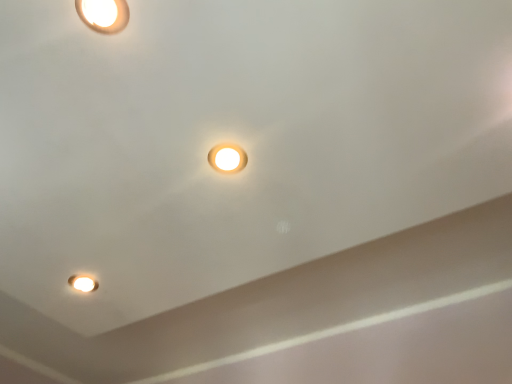
Question: From the image's perspective, would you say matte white light fixture at lower left is positioned over matte white lamp at upper left, acting as the 2th lamp starting from the right?

Choices:
 (A) no
 (B) yes

Answer: (A)

Question: From a real-world perspective, does matte white light fixture at lower left sit lower than matte white lamp at upper left, which is counted as the 2th lamp, starting from the back?

Choices:
 (A) no
 (B) yes

Answer: (A)

Question: Is matte white light fixture at lower left looking in the opposite direction of matte white lamp at upper left, acting as the 2th lamp starting from the right?

Choices:
 (A) no
 (B) yes

Answer: (A)

Question: Can you confirm if matte white light fixture at lower left is wider than matte white lamp at upper left, the first lamp in the left-to-right sequence?

Choices:
 (A) yes
 (B) no

Answer: (B)

Question: Can you confirm if matte white light fixture at lower left is smaller than matte white lamp at upper left, the first lamp from the top?

Choices:
 (A) yes
 (B) no

Answer: (A)

Question: Considering the relative sizes of matte white light fixture at lower left and matte white lamp at upper left, acting as the 2th lamp starting from the right, in the image provided, is matte white light fixture at lower left bigger than matte white lamp at upper left, acting as the 2th lamp starting from the right,?

Choices:
 (A) yes
 (B) no

Answer: (B)

Question: Does matte white lamp at center, the second lamp positioned from the front, have a smaller size compared to matte white light fixture at lower left?

Choices:
 (A) no
 (B) yes

Answer: (B)

Question: Is matte white lamp at center, positioned as the first lamp in back-to-front order, not close to matte white light fixture at lower left?

Choices:
 (A) no
 (B) yes

Answer: (A)

Question: Does matte white lamp at center, arranged as the 1th lamp when ordered from the bottom, have a lesser width compared to matte white light fixture at lower left?

Choices:
 (A) yes
 (B) no

Answer: (B)

Question: Is matte white lamp at center, acting as the second lamp starting from the left, directly adjacent to matte white light fixture at lower left?

Choices:
 (A) no
 (B) yes

Answer: (A)

Question: Is matte white lamp at center, arranged as the 1th lamp when viewed from the right, bigger than matte white light fixture at lower left?

Choices:
 (A) yes
 (B) no

Answer: (B)

Question: From a real-world perspective, is matte white lamp at center, positioned as the first lamp in back-to-front order, below matte white light fixture at lower left?

Choices:
 (A) no
 (B) yes

Answer: (B)

Question: Would you say matte white light fixture at lower left is a long distance from matte white lamp at center, which is the 2th lamp in top-to-bottom order?

Choices:
 (A) yes
 (B) no

Answer: (B)